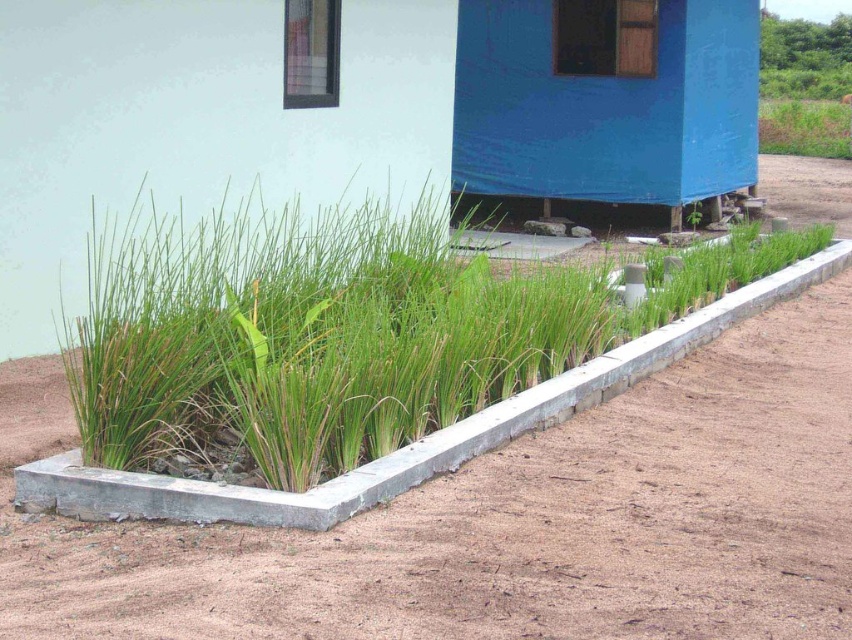
You are a gardener who needs to place a new plant pot in the garden bed. The blue tarpaulin hut at center and the brown soil at lower left are already present. Which object should you avoid placing the pot near to ensure it has enough space to grow?

You should avoid placing the pot near the blue tarpaulin hut at center because it has a larger size compared to the brown soil at lower left, which means it occupies more space and may limit the pot from growing properly.

You are a gardener standing in front of the garden bed. You need to place a small decorative rock between the brown soil at lower left and the green grass at center. Based on their positions, which object should the rock be placed closer to?

The brown soil at lower left is closer to the viewer than the green grass at center, so the rock should be placed closer to the brown soil at lower left to maintain the spatial relationship between them.

You are a gardener planning to plant new flowers in the garden bed. You notice the brown soil at lower left and the green grass at center. Which area would you choose to plant the flowers if you want them to have more space to grow?

The green grass at center has a larger size than the brown soil at lower left, so planting flowers there would provide more space for growth.